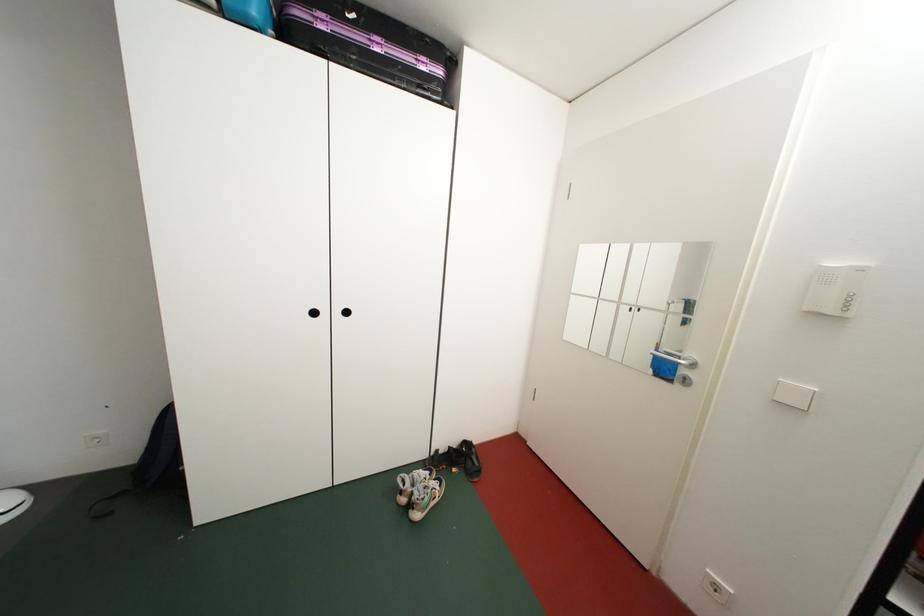
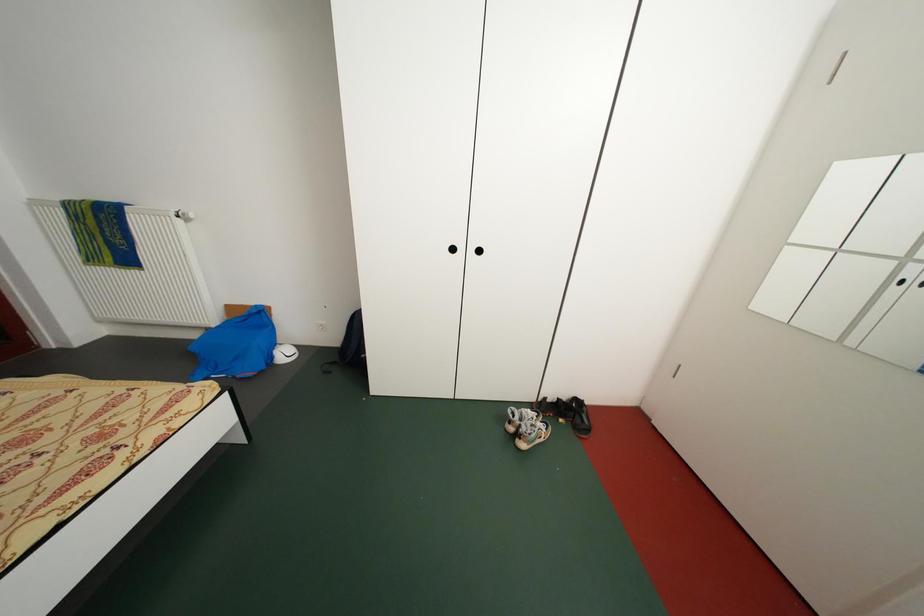
Question: The images are taken continuously from a first-person perspective. In which direction are you moving?

Choices:
 (A) Left
 (B) Right
 (C) Forward
 (D) Backward

Answer: (A)